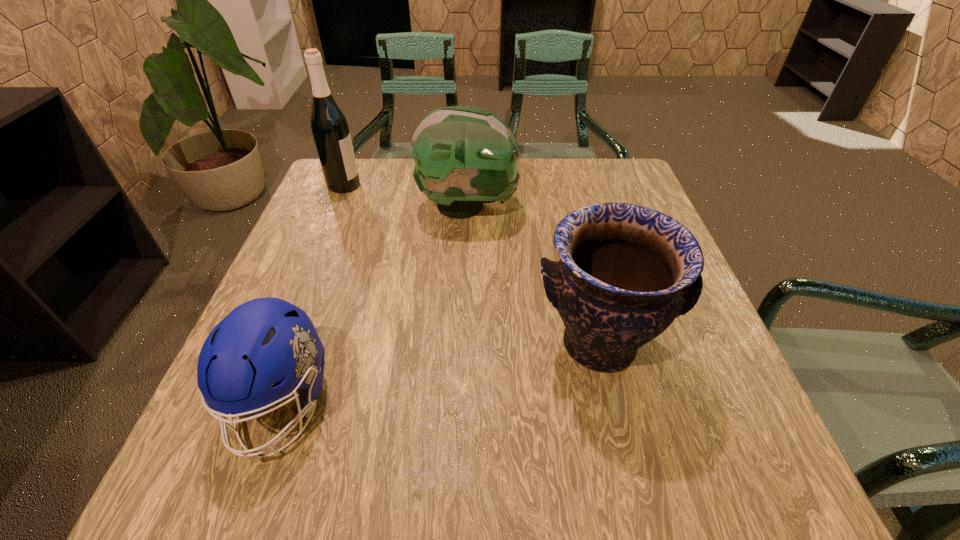
I want to click on the tallest object, so click(330, 130).

The image size is (960, 540). I want to click on the farther football helmet, so click(464, 156).

Locate an element on the screen. The height and width of the screenshot is (540, 960). the right football helmet is located at coordinates (464, 156).

Where is `pottery`? Image resolution: width=960 pixels, height=540 pixels. pottery is located at coordinates (625, 272).

You are a GUI agent. You are given a task and a screenshot of the screen. Output one action in this format:
    pyautogui.click(x=<x>, y=<y>)
    Task: Click on the left football helmet
    
    Given the screenshot: What is the action you would take?
    (x=263, y=341)

At what (x,y) coordinates should I click in order to perform the action: click on the shortest object. Please return your answer as a coordinate pair (x, y). This screenshot has width=960, height=540. Looking at the image, I should click on (263, 341).

At what (x,y) coordinates should I click in order to perform the action: click on free location located 0.050m on the label of the tallest object. Please return your answer as a coordinate pair (x, y). Looking at the image, I should click on (378, 185).

Identify the location of vacant region located on the visor of the right football helmet. (599, 206).

Find the location of `vacant space located 0.130m on the front handle of the pottery`. vacant space located 0.130m on the front handle of the pottery is located at coordinates (629, 474).

Where is `wine bottle present at the far edge`? wine bottle present at the far edge is located at coordinates (330, 130).